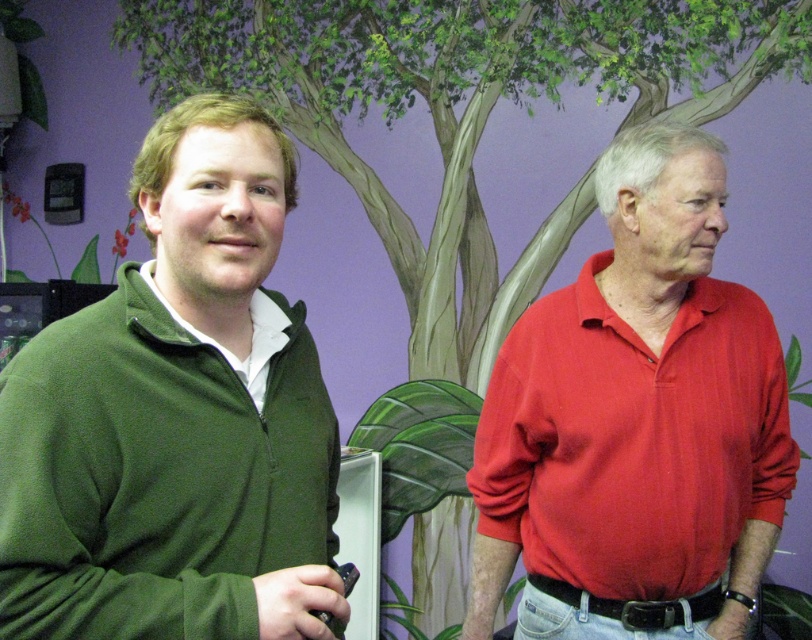
You are standing in front of the mural and want to hand a small package to the person wearing the green fleece sweater at left. Based on their position, where should you aim to place the package so it reaches them?

The green fleece sweater at left is positioned at coordinates point [176,417], so you should aim for that location to ensure the package reaches them.

You are a photographer setting up a photo shoot. You need to position two subjects so they are exactly 24 inches apart. Currently, the green fleece sweater at left and the matte red shirt at right are positioned 21.90 inches apart. Can you adjust their positions to meet the required distance?

The current distance between the green fleece sweater at left and the matte red shirt at right is 21.90 inches. To meet the required 24 inches, you need to increase the distance between them by 2.10 inches.